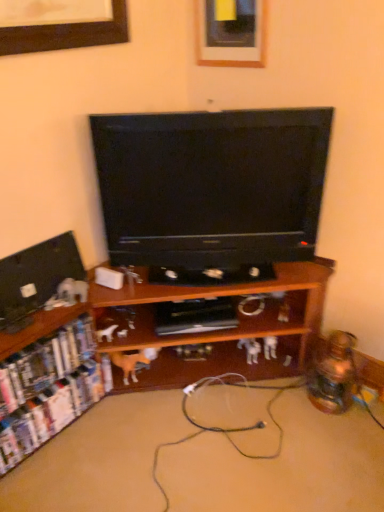
You are a GUI agent. You are given a task and a screenshot of the screen. Output one action in this format:
    pyautogui.click(x=<x>, y=<y>)
    Task: Click on the empty space that is ontop of wooden shelf at lower left
    The height and width of the screenshot is (512, 384).
    Given the screenshot: What is the action you would take?
    [214, 435]